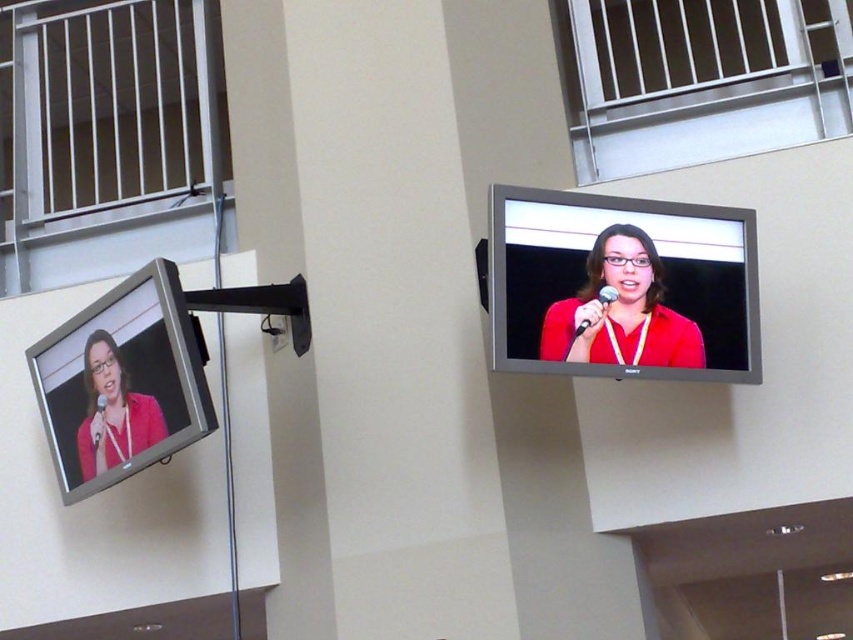
Can you confirm if matte black monitor at upper right is smaller than matte black monitor at left?

Correct, matte black monitor at upper right occupies less space than matte black monitor at left.

I want to click on matte black monitor at upper right, so click(622, 285).

Can you confirm if matte black monitor at left is smaller than matte red shirt at upper right?

No, matte black monitor at left is not smaller than matte red shirt at upper right.

Is point (195, 346) positioned after point (611, 236)?

No, (195, 346) is in front of (611, 236).

The height and width of the screenshot is (640, 853). What do you see at coordinates (120, 384) in the screenshot?
I see `matte black monitor at left` at bounding box center [120, 384].

Identify the location of matte black monitor at left. This screenshot has width=853, height=640. (120, 384).

Is metallic white balcony at upper center above matte red shirt at upper right?

Yes, metallic white balcony at upper center is above matte red shirt at upper right.

Describe the element at coordinates (699, 80) in the screenshot. I see `metallic white balcony at upper center` at that location.

Does point (691, 164) come closer to viewer compared to point (660, 314)?

That is False.

The image size is (853, 640). I want to click on metallic white balcony at upper center, so click(x=699, y=80).